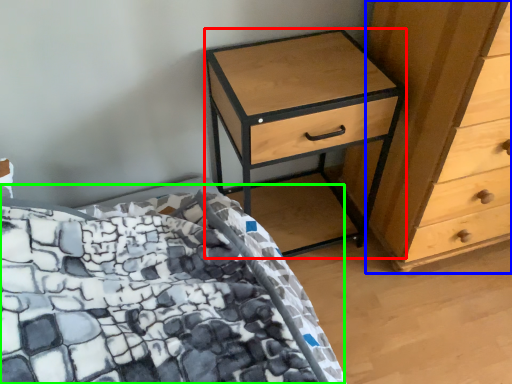
Question: Based on their relative distances, which object is farther from nightstand (highlighted by a red box)? Choose from chest of drawers (highlighted by a blue box) and bed (highlighted by a green box).

Choices:
 (A) chest of drawers
 (B) bed

Answer: (B)